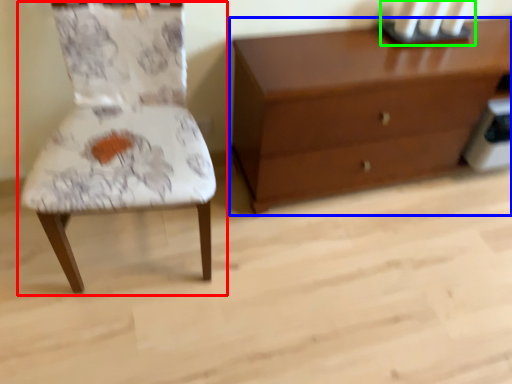
Question: Considering the real-world distances, which object is closest to chair (highlighted by a red box)? chest of drawers (highlighted by a blue box) or candle holder (highlighted by a green box).

Choices:
 (A) chest of drawers
 (B) candle holder

Answer: (A)